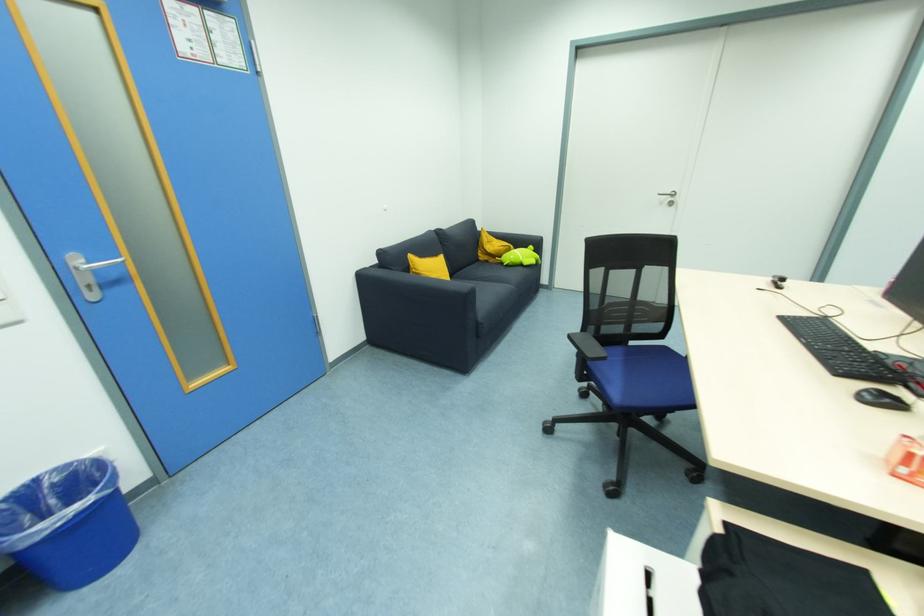
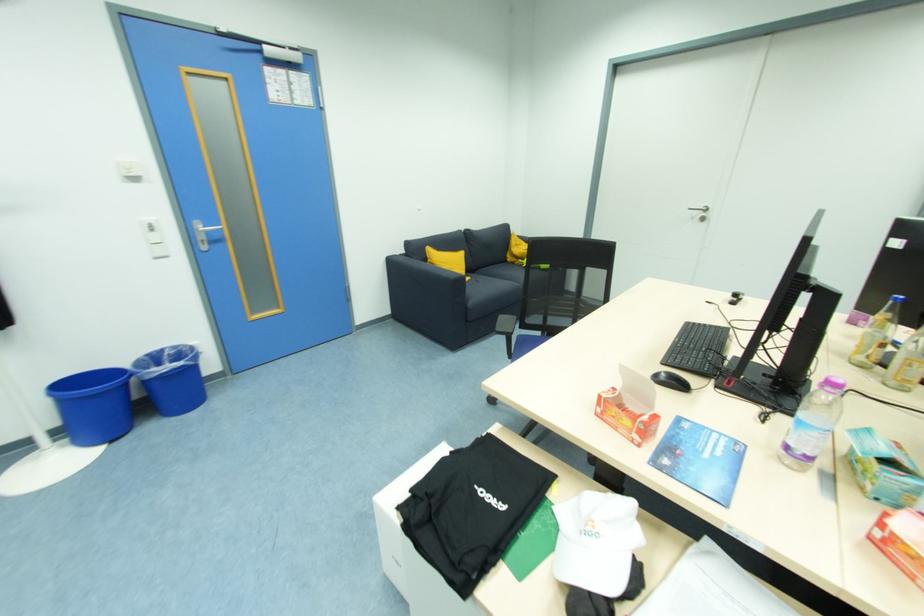
Find the pixel in the second image that matches the point at 809,342 in the first image.

(684, 342)